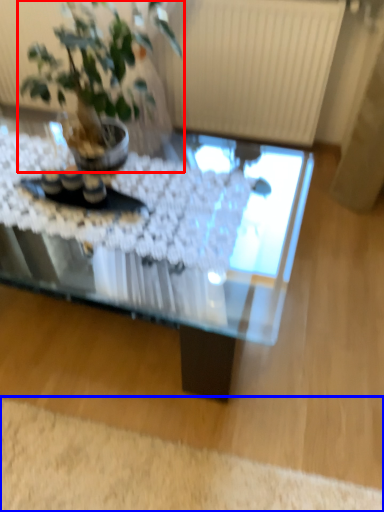
Question: Which point is closer to the camera, houseplant (highlighted by a red box) or plain (highlighted by a blue box)?

Choices:
 (A) houseplant
 (B) plain

Answer: (A)